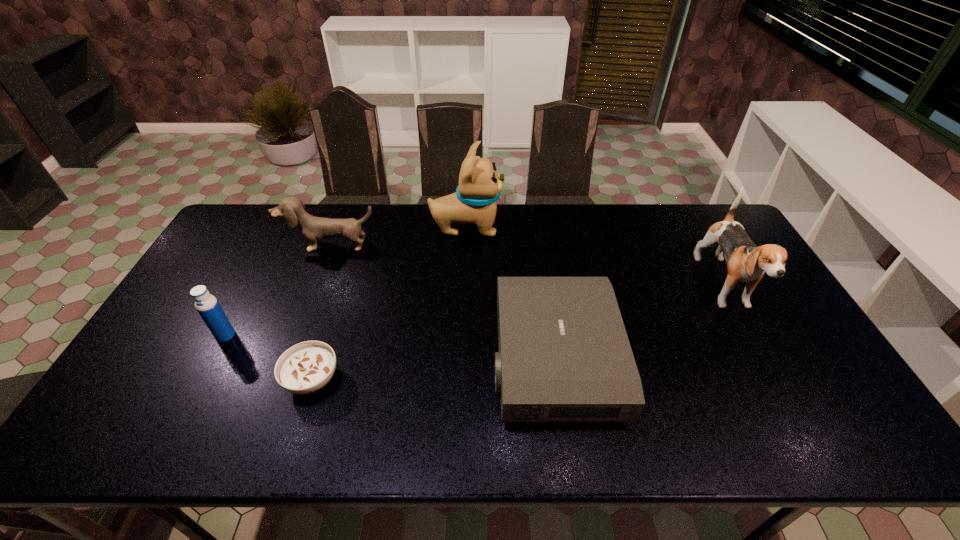
Locate an element on the screen. Image resolution: width=960 pixels, height=540 pixels. unoccupied area between the rightmost object and the second puppy from right to left is located at coordinates (595, 258).

Locate an element on the screen. The image size is (960, 540). vacant space that is in between the soup bowl and the fifth tallest object is located at coordinates (433, 369).

This screenshot has height=540, width=960. Find the location of `free space that is in between the water bottle and the soup bowl`. free space that is in between the water bottle and the soup bowl is located at coordinates (269, 357).

Find the location of a particular element. The width and height of the screenshot is (960, 540). vacant region between the second puppy from left to right and the soup bowl is located at coordinates (389, 303).

This screenshot has height=540, width=960. Find the location of `vacant area that lies between the shortest puppy and the second shortest object`. vacant area that lies between the shortest puppy and the second shortest object is located at coordinates (443, 302).

The image size is (960, 540). What are the coordinates of `free space that is in between the shortest puppy and the leftmost object` in the screenshot? It's located at (278, 291).

You are a GUI agent. You are given a task and a screenshot of the screen. Output one action in this format:
    pyautogui.click(x=<x>, y=<y>)
    Task: Click on the vacant space that is in between the rightmost puppy and the shortest puppy
    This screenshot has height=540, width=960.
    Given the screenshot: What is the action you would take?
    pyautogui.click(x=527, y=267)

The width and height of the screenshot is (960, 540). Find the location of `free spot between the fifth tallest object and the water bottle`. free spot between the fifth tallest object and the water bottle is located at coordinates (390, 347).

The height and width of the screenshot is (540, 960). Find the location of `free space between the second puppy from right to left and the rightmost object`. free space between the second puppy from right to left and the rightmost object is located at coordinates (595, 258).

Select which object appears as the third closest to the soup bowl. Please provide its 2D coordinates. Your answer should be formatted as a tuple, i.e. [(x, y)], where the tuple contains the x and y coordinates of a point satisfying the conditions above.

[(314, 229)]